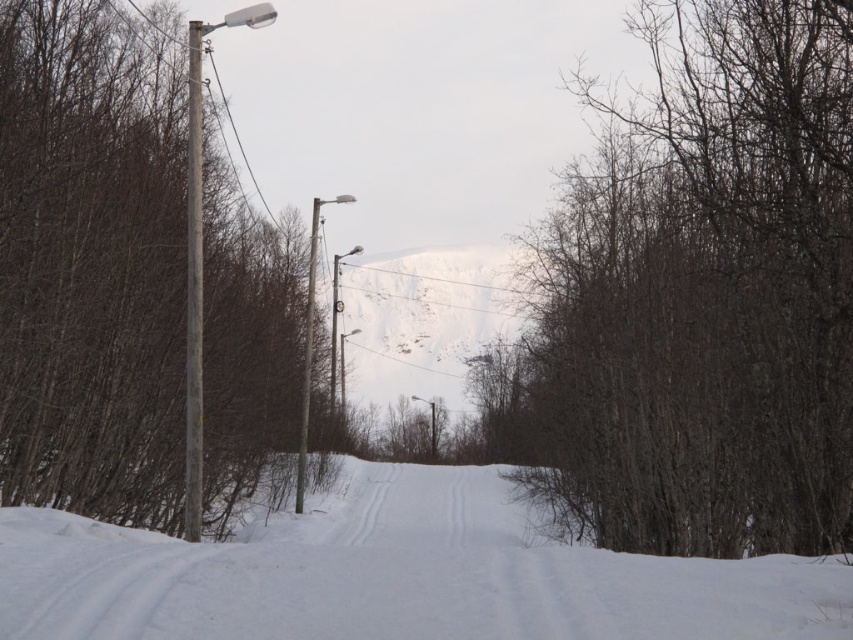
You are standing at the point marked as point (737, 445). There are two utility poles with streetlights along the road. How far apart are these two utility poles?

The two utility poles with streetlights along the road are 16.27 meters apart.